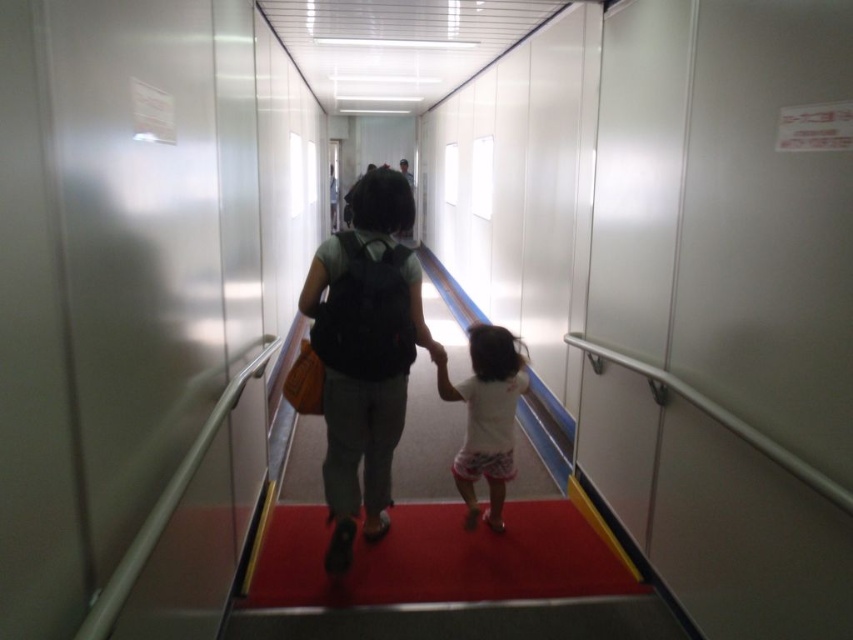
You are standing in the corridor and see two points marked in the scene. Which point is closer to you, point [312,348] or point [457,468]?

Point [312,348] is closer to the viewer than point [457,468].

You are a security guard in the corridor. You notice the matte black backpack at center and the white cotton shirt at center. Which object is nearer to you?

The matte black backpack at center is closer to the viewer than the white cotton shirt at center.

You are a security guard in the corridor. You see the matte black backpack at center and the white cotton shirt at center. Which object is positioned to the left?

The matte black backpack at center is to the left of the white cotton shirt at center.